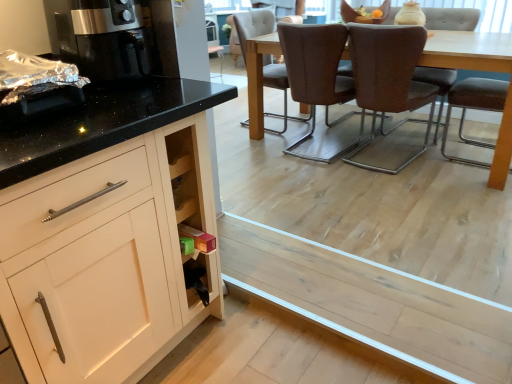
Question: From the image's perspective, is brown leather chair at center, the 4th chair in the right-to-left sequence, below brown leather chair at center, placed as the 3th chair when sorted from right to left?

Choices:
 (A) no
 (B) yes

Answer: (A)

Question: Is brown leather chair at center, the 2th chair when ordered from left to right, closer to camera compared to brown leather chair at center, placed as the 3th chair when sorted from right to left?

Choices:
 (A) yes
 (B) no

Answer: (B)

Question: Is brown leather chair at center, the 4th chair in the right-to-left sequence, wider than brown leather chair at center, the third chair positioned from the left?

Choices:
 (A) yes
 (B) no

Answer: (B)

Question: Does brown leather chair at center, the 2th chair when ordered from left to right, appear on the right side of brown leather chair at center, the third chair positioned from the left?

Choices:
 (A) no
 (B) yes

Answer: (A)

Question: From a real-world perspective, does brown leather chair at center, the 2th chair when ordered from left to right, sit lower than brown leather chair at center, the third chair positioned from the left?

Choices:
 (A) yes
 (B) no

Answer: (A)

Question: Considering the relative sizes of brown leather chair at center, the 4th chair in the right-to-left sequence, and brown leather chair at center, placed as the 3th chair when sorted from right to left, in the image provided, is brown leather chair at center, the 4th chair in the right-to-left sequence, thinner than brown leather chair at center, placed as the 3th chair when sorted from right to left,?

Choices:
 (A) no
 (B) yes

Answer: (B)

Question: Is brown leather chair at center, the 4th chair in the right-to-left sequence, wider than brown fabric chair at center, the 1th chair positioned from the left?

Choices:
 (A) no
 (B) yes

Answer: (A)

Question: Is brown leather chair at center, the 2th chair when ordered from left to right, not within brown fabric chair at center, the 5th chair positioned from the right?

Choices:
 (A) yes
 (B) no

Answer: (A)

Question: From a real-world perspective, is brown leather chair at center, the 4th chair in the right-to-left sequence, positioned under brown fabric chair at center, the 5th chair positioned from the right, based on gravity?

Choices:
 (A) yes
 (B) no

Answer: (A)

Question: Can you confirm if brown leather chair at center, the 4th chair in the right-to-left sequence, is smaller than brown fabric chair at center, the 1th chair positioned from the left?

Choices:
 (A) no
 (B) yes

Answer: (B)

Question: Considering the relative positions of brown leather chair at center, the 2th chair when ordered from left to right, and brown fabric chair at center, the 5th chair positioned from the right, in the image provided, is brown leather chair at center, the 2th chair when ordered from left to right, in front of brown fabric chair at center, the 5th chair positioned from the right,?

Choices:
 (A) yes
 (B) no

Answer: (A)

Question: Can you confirm if brown leather chair at center, the 2th chair when ordered from left to right, is bigger than brown fabric chair at center, the 5th chair positioned from the right?

Choices:
 (A) yes
 (B) no

Answer: (B)

Question: From the image's perspective, would you say satin black coffee machine at left is shown under brown leather chair at center, the fifth chair when ordered from left to right?

Choices:
 (A) yes
 (B) no

Answer: (A)